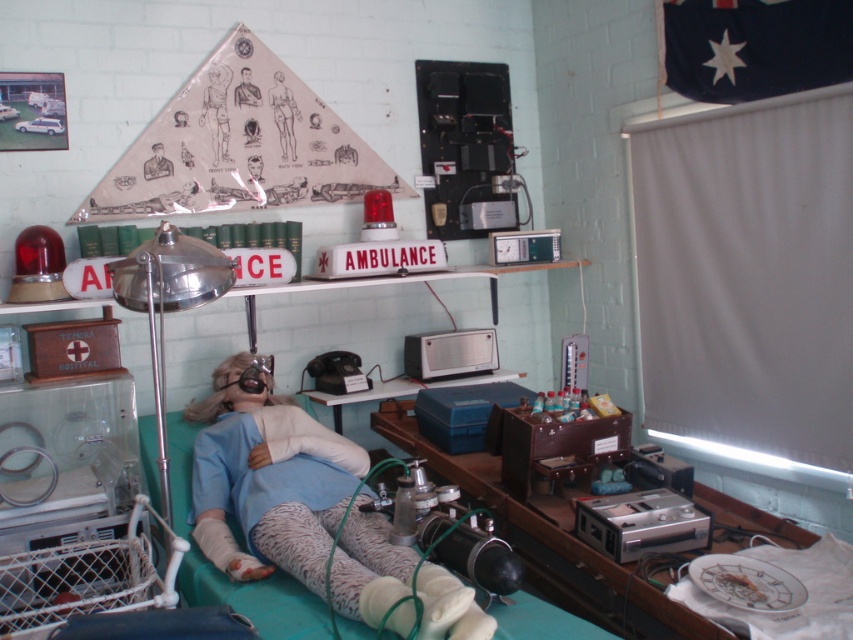
You are a medical student observing the vintage medical display. You notice the blue fabric doll at center and the metallic silver ambulance sign at upper center. Which object is positioned higher in the scene?

The metallic silver ambulance sign at upper center is positioned higher than the blue fabric doll at center.

You are a medical student observing the vintage medical display. You notice the matte paper figure at center and the metallic silver ambulance sign at upper center. Which object is taller?

The matte paper figure at center is taller than the metallic silver ambulance sign at upper center.